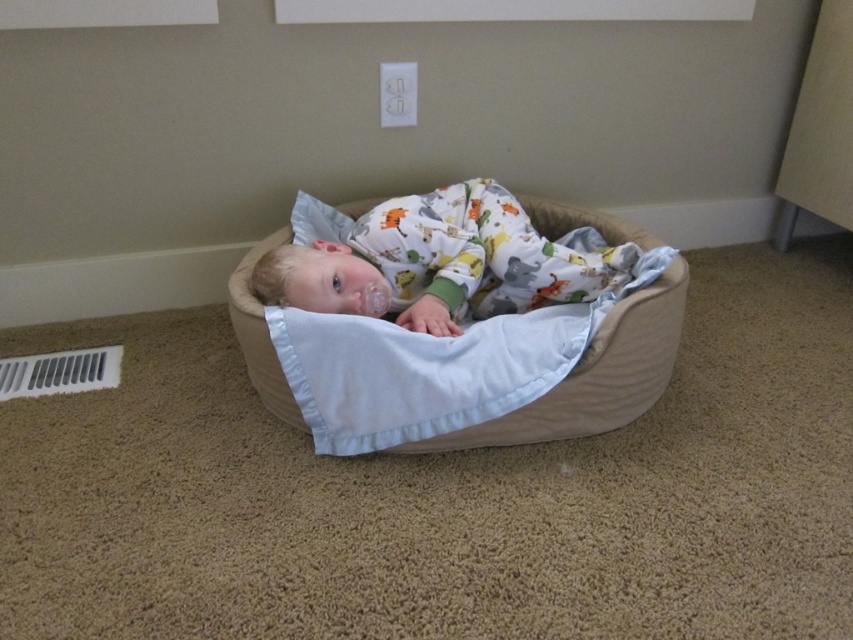
Which is above, beige fabric infant bed at center or white soft baby at center?

Positioned higher is white soft baby at center.

Can you confirm if beige fabric infant bed at center is smaller than white soft baby at center?

No.

Who is more distant from viewer, (645, 349) or (345, 305)?

Point (345, 305)

At what (x,y) coordinates should I click in order to perform the action: click on beige fabric infant bed at center. Please return your answer as a coordinate pair (x, y). The height and width of the screenshot is (640, 853). Looking at the image, I should click on (471, 358).

Can you confirm if beige fabric infant bed at center is positioned above white soft pillow at upper center?

Actually, beige fabric infant bed at center is below white soft pillow at upper center.

Between beige fabric infant bed at center and white soft pillow at upper center, which one has less height?

Standing shorter between the two is white soft pillow at upper center.

Where is `beige fabric infant bed at center`? beige fabric infant bed at center is located at coordinates (471, 358).

This screenshot has width=853, height=640. What are the coordinates of `beige fabric infant bed at center` in the screenshot? It's located at (471, 358).

Between white soft baby at center and white soft pillow at upper center, which one has more height?

Standing taller between the two is white soft baby at center.

Image resolution: width=853 pixels, height=640 pixels. In order to click on white soft baby at center in this screenshot , I will do `click(439, 262)`.